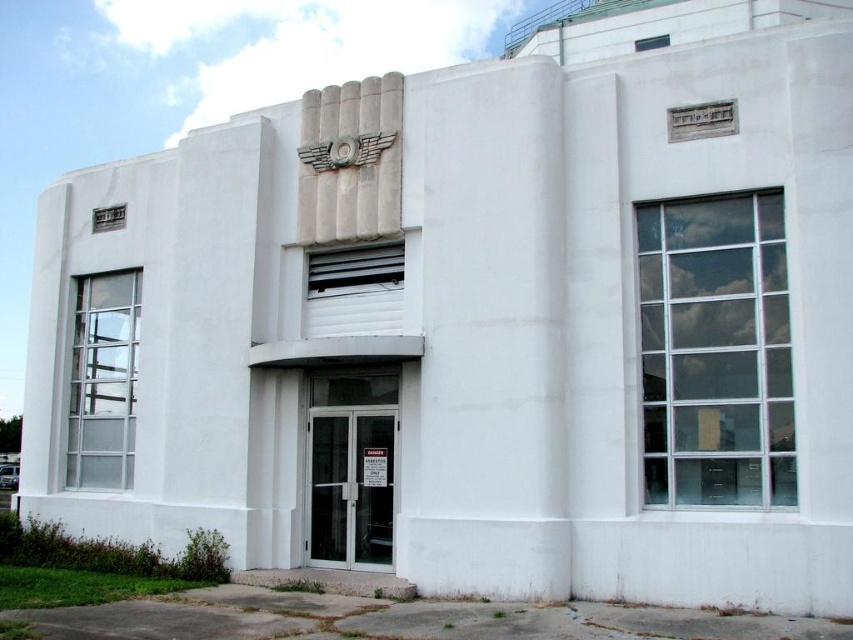
Does white smooth concrete pillar at center have a smaller size compared to metallic silver clock at center?

Yes, white smooth concrete pillar at center is smaller than metallic silver clock at center.

The image size is (853, 640). Identify the location of white smooth concrete pillar at center. (492, 339).

This screenshot has height=640, width=853. What do you see at coordinates (492, 339) in the screenshot? I see `white smooth concrete pillar at center` at bounding box center [492, 339].

Locate an element on the screen. The width and height of the screenshot is (853, 640). white smooth concrete pillar at center is located at coordinates (492, 339).